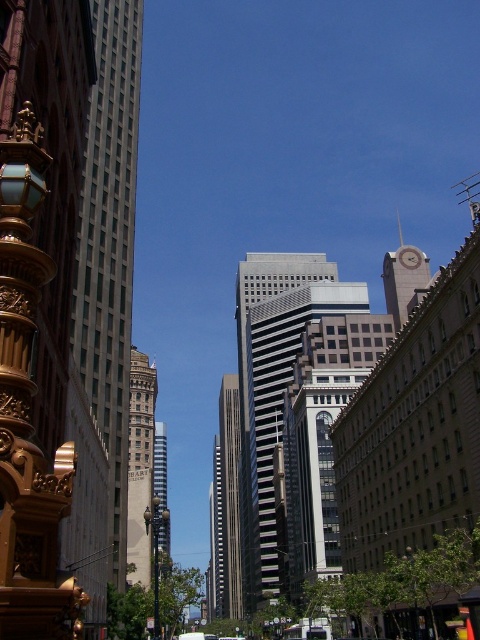
You are standing in the middle of the urban scene and want to take a photo. There are two points marked in the image, point 1 at coordinates point (145, 417) and point 2 at coordinates point (418, 266). Which point is closer to your camera lens?

Point (145, 417) is further to the camera than point (418, 266). Therefore, point (418, 266) is closer to the camera lens.